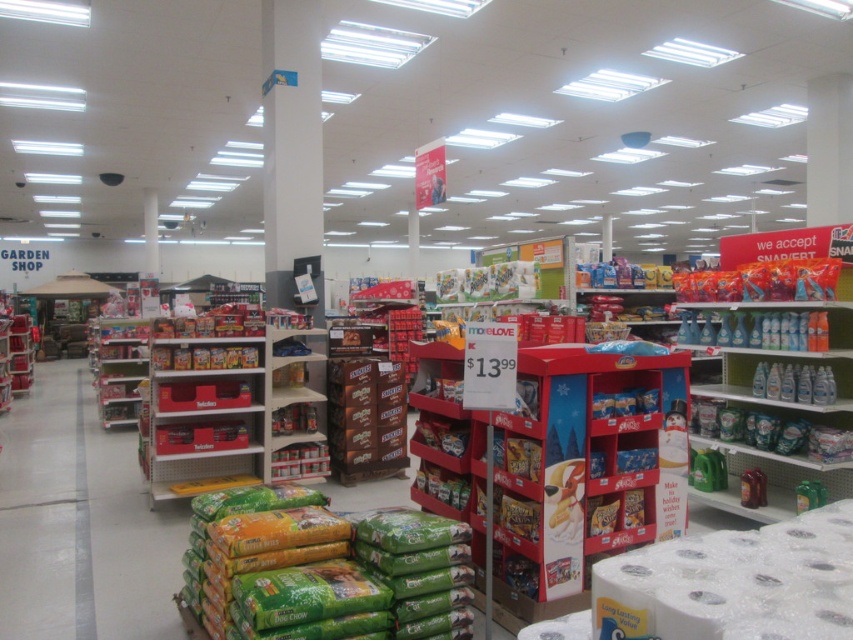
You are a customer in the pet supplies section of a retail store. You need to find the green matte dog chow at lower center. Based on the store layout described, can you determine its exact location using the coordinate system provided?

The green matte dog chow at lower center is located at point coordinates (323, 570).

You are standing in the retail store and want to locate two specific points marked in the image. Which point, point (426, 540) or point (801, 307), is closer to you?

Point (426, 540) is closer to the viewer than point (801, 307).